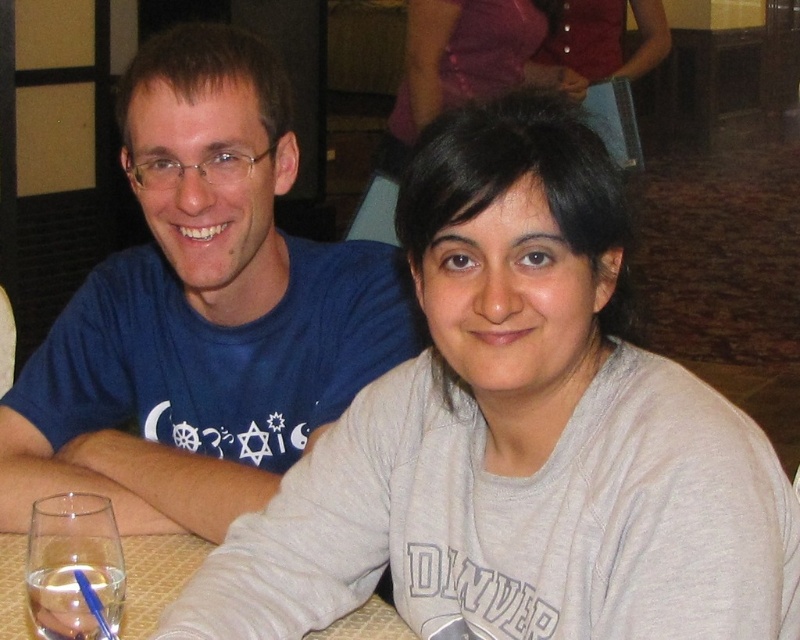
Which of these two, blue cotton t-shirt at left or clear glass wine glass at lower left, stands shorter?

clear glass wine glass at lower left is shorter.

What do you see at coordinates (202, 310) in the screenshot? The image size is (800, 640). I see `blue cotton t-shirt at left` at bounding box center [202, 310].

Where is `blue cotton t-shirt at left`? This screenshot has height=640, width=800. blue cotton t-shirt at left is located at coordinates (202, 310).

Does matte purple blouse at upper center have a lesser width compared to clear glass table at lower left?

Incorrect, matte purple blouse at upper center's width is not less than clear glass table at lower left's.

Who is lower down, matte purple blouse at upper center or clear glass table at lower left?

Positioned lower is clear glass table at lower left.

Does point (641, 10) come in front of point (148, 627)?

No, it is behind (148, 627).

This screenshot has width=800, height=640. I want to click on matte purple blouse at upper center, so click(x=504, y=54).

Between point (176, 129) and point (612, 65), which one is positioned behind?

Point (612, 65)

Is point (360, 340) positioned in front of point (652, 35)?

Yes, it is.

This screenshot has width=800, height=640. Find the location of `blue cotton t-shirt at left`. blue cotton t-shirt at left is located at coordinates (202, 310).